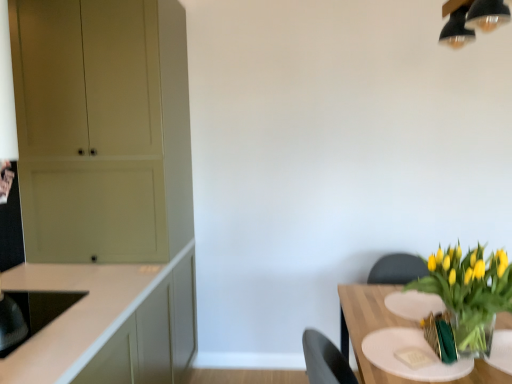
Question: In terms of size, does translucent glass table at lower right appear bigger or smaller than white matte cabinet at left, arranged as the second cabinetry when viewed from the back?

Choices:
 (A) big
 (B) small

Answer: (B)

Question: Is point (485, 367) closer or farther from the camera than point (59, 281)?

Choices:
 (A) farther
 (B) closer

Answer: (B)

Question: Estimate the real-world distances between objects in this image. Which object is farther from the white matte cabinet at left, arranged as the second cabinetry when viewed from the back?

Choices:
 (A) translucent glass table at lower right
 (B) translucent glass vase at lower right
 (C) matte beige cabinet at left, the 2th cabinetry in the front-to-back sequence
 (D) black glossy sink at lower left

Answer: (B)

Question: Which object is the farthest from the translucent glass table at lower right?

Choices:
 (A) black glossy sink at lower left
 (B) white matte cabinet at left, positioned as the 1th cabinetry in front-to-back order
 (C) matte beige cabinet at left, the 2th cabinetry in the front-to-back sequence
 (D) translucent glass vase at lower right

Answer: (C)